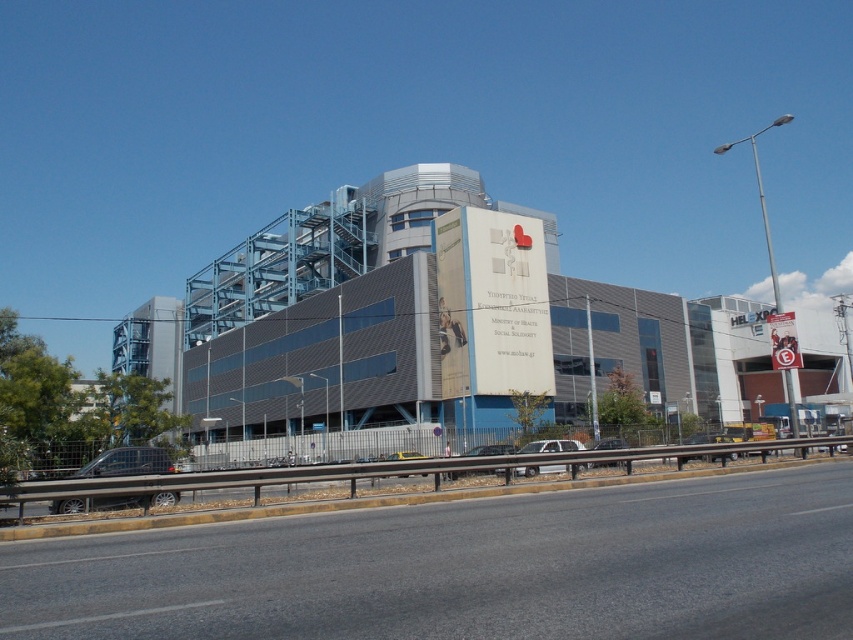
Does metallic silver car at lower left appear over metallic silver car at center?

Correct, metallic silver car at lower left is located above metallic silver car at center.

Does metallic silver car at lower left have a smaller size compared to metallic silver car at center?

Yes, metallic silver car at lower left is smaller than metallic silver car at center.

Which is behind, point (108, 500) or point (474, 470)?

The point (474, 470) is behind.

Where is `metallic silver car at lower left`? metallic silver car at lower left is located at coordinates (126, 461).

Is asphalt road at lower center in front of metallic silver car at lower left?

Yes, asphalt road at lower center is in front of metallic silver car at lower left.

Looking at this image, is asphalt road at lower center bigger than metallic silver car at lower left?

Indeed, asphalt road at lower center has a larger size compared to metallic silver car at lower left.

Who is more forward, (44, 582) or (67, 477)?

Point (44, 582)

Locate an element on the screen. asphalt road at lower center is located at coordinates (469, 568).

Does metallic silver car at lower left come in front of white matte sedan at center?

Yes.

Between metallic silver car at lower left and white matte sedan at center, which one is positioned lower?

white matte sedan at center is lower down.

You are a GUI agent. You are given a task and a screenshot of the screen. Output one action in this format:
    pyautogui.click(x=<x>, y=<y>)
    Task: Click on the metallic silver car at lower left
    This screenshot has height=640, width=853.
    Given the screenshot: What is the action you would take?
    pyautogui.click(x=126, y=461)

Locate an element on the screen. Image resolution: width=853 pixels, height=640 pixels. metallic silver car at lower left is located at coordinates (126, 461).